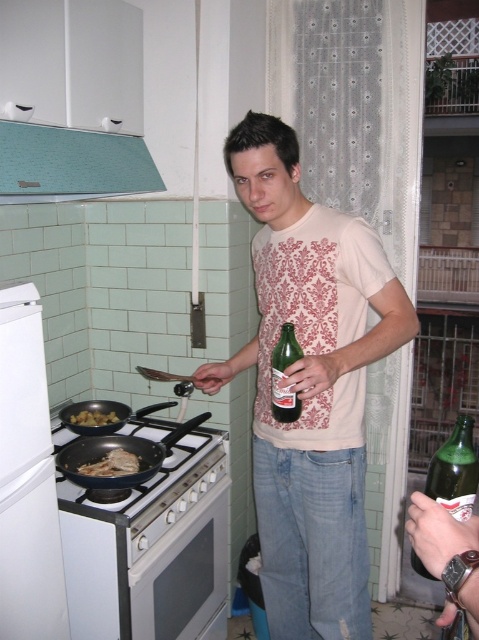
Does green glass bottle at center appear under brown crispy meat at stove?

No.

Which of these two, green glass bottle at center or brown crispy meat at stove, stands taller?

green glass bottle at center is taller.

Is point (271, 362) positioned after point (102, 464)?

No, (271, 362) is closer to viewer.

The width and height of the screenshot is (479, 640). Find the location of `green glass bottle at center`. green glass bottle at center is located at coordinates (284, 376).

Who is more forward, (205, 560) or (11, 298)?

Point (11, 298)

Is point (170, 557) positioned in front of point (10, 292)?

No, (170, 557) is further to viewer.

What are the coordinates of `white glossy stove at lower left` in the screenshot? It's located at (151, 548).

Does matte pink t-shirt at center appear under teal fabric exhaust hood at upper left?

Yes.

Does point (340, 372) come behind point (15, 188)?

That is False.

Which is in front, point (260, 141) or point (92, 192)?

Point (260, 141) is more forward.

Image resolution: width=479 pixels, height=640 pixels. Identify the location of matte pink t-shirt at center. (309, 385).